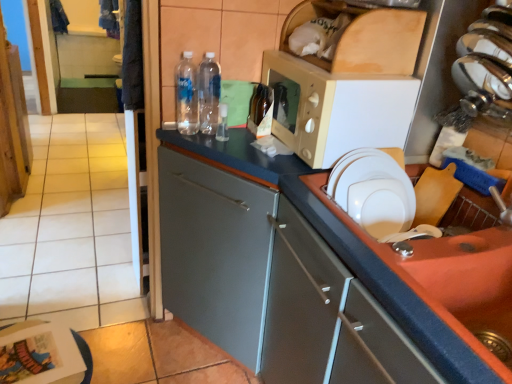
Locate an element on the screen. Image resolution: width=512 pixels, height=384 pixels. orange matte sink at lower right is located at coordinates (438, 260).

The width and height of the screenshot is (512, 384). I want to click on translucent glass bottle at center, the third bottle viewed from the left, so click(260, 111).

You are a GUI agent. You are given a task and a screenshot of the screen. Output one action in this format:
    pyautogui.click(x=<x>, y=<y>)
    Task: Click on the beige plastic microwave at upper center
    Image resolution: width=512 pixels, height=384 pixels.
    Given the screenshot: What is the action you would take?
    pyautogui.click(x=336, y=109)

Does dark blue fabric at upper left appear on the left side of clear plastic bottle at center, placed as the third bottle when sorted from right to left?

Correct, you'll find dark blue fabric at upper left to the left of clear plastic bottle at center, placed as the third bottle when sorted from right to left.

What are the coordinates of `laundry lying on the left of clear plastic bottle at center, the first bottle in the left-to-right sequence` in the screenshot? It's located at (58, 17).

Which is correct: dark blue fabric at upper left is inside clear plastic bottle at center, the first bottle in the left-to-right sequence, or outside of it?

dark blue fabric at upper left is outside clear plastic bottle at center, the first bottle in the left-to-right sequence.

Which of these two, dark blue fabric at upper left or clear plastic bottle at center, the first bottle in the left-to-right sequence, is thinner?

With smaller width is clear plastic bottle at center, the first bottle in the left-to-right sequence.

Does white matte paper plate at right appear on the right side of clear plastic bottle at center, placed as the third bottle when sorted from right to left?

Yes, white matte paper plate at right is to the right of clear plastic bottle at center, placed as the third bottle when sorted from right to left.

From the image's perspective, which one is positioned higher, white matte paper plate at right or clear plastic bottle at center, the first bottle in the left-to-right sequence?

clear plastic bottle at center, the first bottle in the left-to-right sequence, from the image's perspective.

You are a GUI agent. You are given a task and a screenshot of the screen. Output one action in this format:
    pyautogui.click(x=<x>, y=<y>)
    Task: Click on the bottle that is the 1st object located behind the white matte paper plate at right
    The width and height of the screenshot is (512, 384).
    Given the screenshot: What is the action you would take?
    (x=186, y=96)

Is white matte paper plate at right oriented away from clear plastic bottle at center, placed as the third bottle when sorted from right to left?

No, white matte paper plate at right's orientation is not away from clear plastic bottle at center, placed as the third bottle when sorted from right to left.

From a real-world perspective, is orange matte sink at lower right beneath white tile at upper left?

Incorrect, from a real-world perspective, orange matte sink at lower right is higher than white tile at upper left.

Can you confirm if orange matte sink at lower right is smaller than white tile at upper left?

No, orange matte sink at lower right is not smaller than white tile at upper left.

Is point (382, 155) closer or farther from the camera than point (84, 269)?

Point (382, 155) appears to be closer to the viewer than point (84, 269).

Is the depth of orange matte sink at lower right greater than that of white tile at upper left?

No, it is not.

Is dark blue fabric at upper left spatially inside beige plastic microwave at upper center, or outside of it?

dark blue fabric at upper left cannot be found inside beige plastic microwave at upper center.

From a real-world perspective, which object rests below the other?

In real-world perspective, dark blue fabric at upper left is lower.

From the image's perspective, is dark blue fabric at upper left located above beige plastic microwave at upper center?

Yes.

In the image, there is a orange matte sink at lower right. Identify the location of laundry below it (from a real-world perspective). (58, 17).

How different are the orientations of dark blue fabric at upper left and orange matte sink at lower right in degrees?

88.5 degrees.

Is dark blue fabric at upper left closer to the viewer compared to orange matte sink at lower right?

No, it is not.

Considering the sizes of objects dark blue fabric at upper left and orange matte sink at lower right in the image provided, who is smaller, dark blue fabric at upper left or orange matte sink at lower right?

dark blue fabric at upper left.

Is orange matte sink at lower right placed right next to dark blue fabric at upper left?

No, orange matte sink at lower right is not making contact with dark blue fabric at upper left.

Between orange matte sink at lower right and dark blue fabric at upper left, which one has larger width?

orange matte sink at lower right is wider.

Considering the points (337, 168) and (52, 14), which point is behind, point (337, 168) or point (52, 14)?

Positioned behind is point (52, 14).

How many degrees apart are the facing directions of orange matte sink at lower right and dark blue fabric at upper left?

88.5 degrees separate the facing orientations of orange matte sink at lower right and dark blue fabric at upper left.

At what (x,y) coordinates should I click in order to perform the action: click on bottle lying below the clear plastic bottle at center, the first bottle in the left-to-right sequence (from the image's perspective). Please return your answer as a coordinate pair (x, y). Looking at the image, I should click on (260, 111).

Can we say clear plastic bottle at center, placed as the third bottle when sorted from right to left, lies outside translucent glass bottle at center, the third bottle viewed from the left?

clear plastic bottle at center, placed as the third bottle when sorted from right to left, lies outside translucent glass bottle at center, the third bottle viewed from the left,'s area.

Considering the positions of point (191, 94) and point (263, 92), is point (191, 94) closer or farther from the camera than point (263, 92)?

Point (191, 94) is positioned closer to the camera compared to point (263, 92).

The height and width of the screenshot is (384, 512). What are the coordinates of `laundry located above the clear plastic bottle at center, placed as the third bottle when sorted from right to left (from the image's perspective)` in the screenshot? It's located at (58, 17).

Starting from the white matte paper plate at right, which bottle is the 3rd one to the left? Please provide its 2D coordinates.

[(186, 96)]

Looking at the image, which one is located closer to translucent glass bottle at center, the third bottle viewed from the left, clear plastic bottle at center, the first bottle in the left-to-right sequence, or white matte paper plate at right?

clear plastic bottle at center, the first bottle in the left-to-right sequence, is positioned closer to the anchor translucent glass bottle at center, the third bottle viewed from the left.

Which object lies further to the anchor point beige plastic microwave at upper center, white matte paper plate at right or orange matte sink at lower right?

Among the two, orange matte sink at lower right is located further to beige plastic microwave at upper center.

Which object lies further to the anchor point translucent glass bottle at center, the third bottle viewed from the left, white matte paper plate at right or dark blue fabric at upper left?

dark blue fabric at upper left.

Looking at the image, which one is located closer to transparent plastic bottles at center, the second bottle positioned from the left, dark blue fabric at upper left or matte gray cabinet at center?

Based on the image, matte gray cabinet at center appears to be nearer to transparent plastic bottles at center, the second bottle positioned from the left.

Considering their positions, is orange matte sink at lower right positioned further to white tile at upper left than matte gray cabinet at center?

orange matte sink at lower right is further to white tile at upper left.

Considering their positions, is white tile at upper left positioned further to clear plastic bottle at center, the first bottle in the left-to-right sequence, than matte gray cabinet at center?

white tile at upper left lies further to clear plastic bottle at center, the first bottle in the left-to-right sequence, than the other object.

Estimate the real-world distances between objects in this image. Which object is closer to matte gray cabinet at center, transparent plastic bottles at center, the second bottle positioned from the left, or translucent glass bottle at center, the third bottle viewed from the left?

The object closer to matte gray cabinet at center is translucent glass bottle at center, the third bottle viewed from the left.

When comparing their distances from white matte paper plate at right, does matte gray cabinet at center or white tile at upper left seem closer?

The object closer to white matte paper plate at right is matte gray cabinet at center.

Locate an element on the screen. The image size is (512, 384). cabinetry situated between clear plastic bottle at center, the first bottle in the left-to-right sequence, and white matte paper plate at right from left to right is located at coordinates (289, 276).

Identify the location of bottle between white tile at upper left and transparent plastic bottles at center, placed as the 2th bottle when sorted from right to left. (186, 96).

You are a GUI agent. You are given a task and a screenshot of the screen. Output one action in this format:
    pyautogui.click(x=<x>, y=<y>)
    Task: Click on the microwave oven between transparent plastic bottles at center, placed as the 2th bottle when sorted from right to left, and white matte paper plate at right from left to right
    The width and height of the screenshot is (512, 384).
    Given the screenshot: What is the action you would take?
    pyautogui.click(x=336, y=109)

This screenshot has width=512, height=384. What are the coordinates of `tile positioned between orange matte sink at lower right and dark blue fabric at upper left from near to far` in the screenshot? It's located at (72, 228).